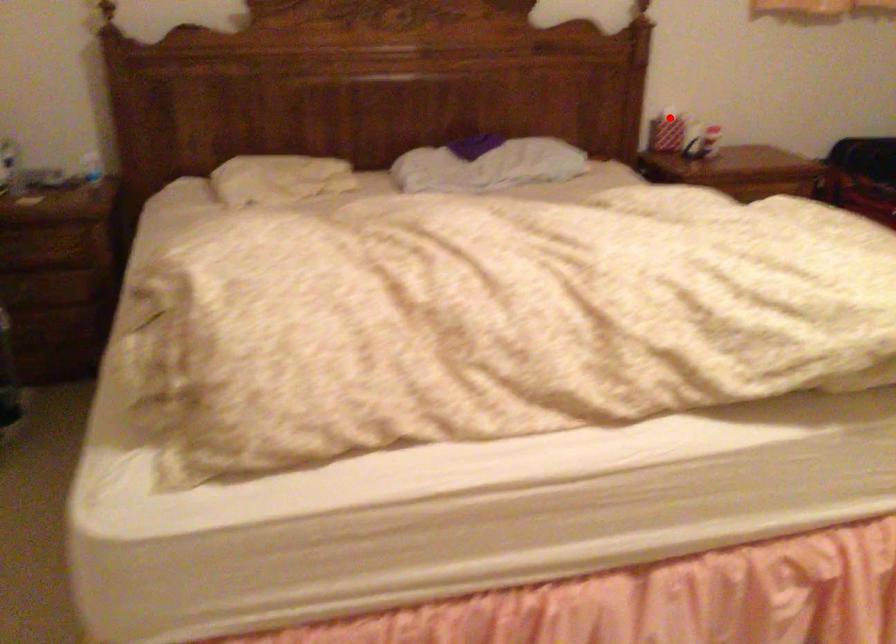
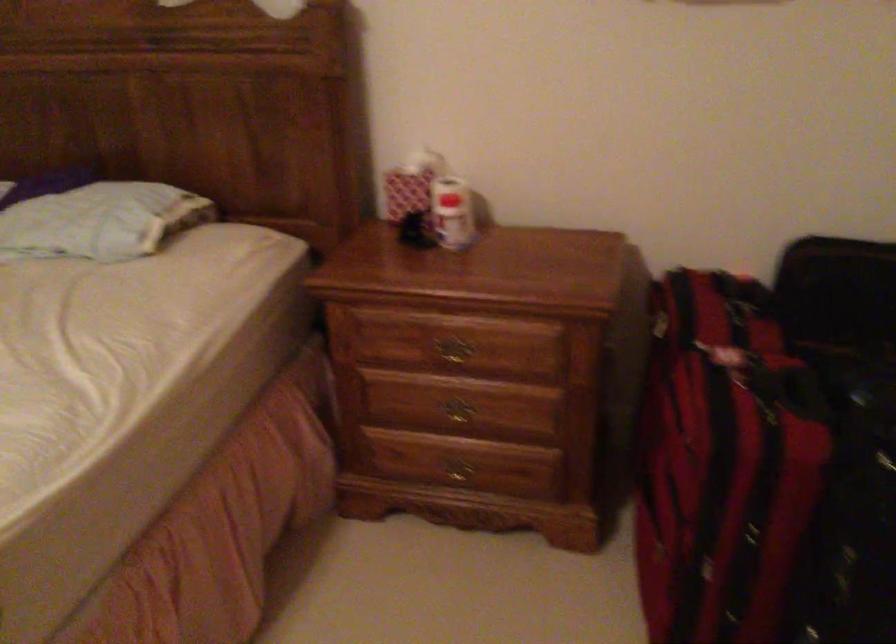
Question: I am providing you with two images of the same scene from different viewpoints. A red point is shown in image1. For the corresponding object point in image2, is it positioned nearer or farther from the camera?

Choices:
 (A) Nearer
 (B) Farther

Answer: (A)